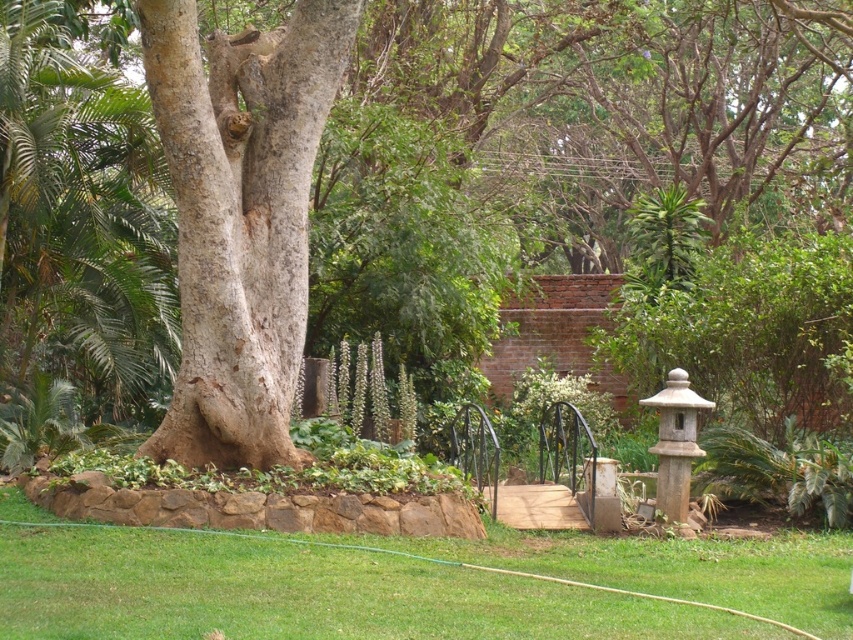
You are standing in the garden and want to walk from the green grass at lower center to the smooth gray bark at center. Which direction should you move?

To move from the green grass at lower center to the smooth gray bark at center, you should move to the left since the grass is to the right of the bark.

You are standing in the garden scene and want to locate the rough bark tree at center. According to the coordinates provided, where should you look?

The rough bark tree at center is located at coordinates point (596, 86).

You are standing in the garden scene and want to take a photo of both point (106,589) and point (248,241). Which point should you focus on first to ensure both are in sharp focus?

You should focus on point (106,589) first because it is closer to the camera than point (248,241). This ensures the closer point is in focus, and the farther point will also be within the depth of field.